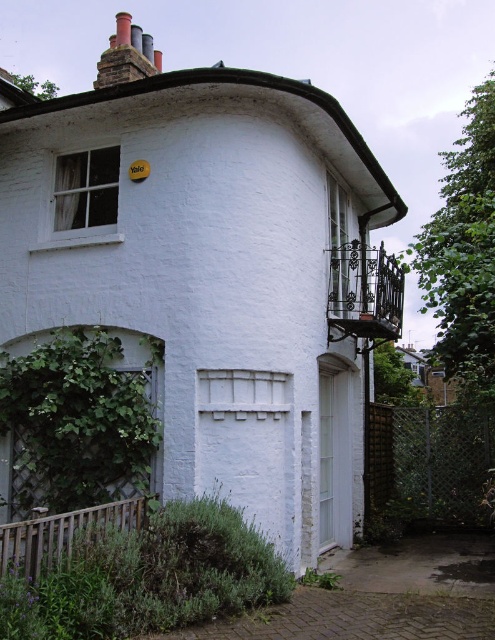
Who is lower down, green leafy ivy at lower left or smooth brick chimney at upper left?

green leafy ivy at lower left is below.

This screenshot has width=495, height=640. Find the location of `green leafy ivy at lower left`. green leafy ivy at lower left is located at coordinates (76, 420).

This screenshot has width=495, height=640. In order to click on green leafy ivy at lower left in this screenshot , I will do `click(76, 420)`.

Does point (79, 444) come closer to viewer compared to point (488, 362)?

Yes, it is in front of point (488, 362).

Where is `green leafy ivy at lower left`? green leafy ivy at lower left is located at coordinates (76, 420).

Who is more distant from viewer, (48, 458) or (485, 368)?

The point (485, 368) is behind.

Find the location of a particular element. green leafy ivy at lower left is located at coordinates (76, 420).

Can you confirm if green leafy ivy at upper right is positioned to the left of smooth brick chimney at upper left?

No, green leafy ivy at upper right is not to the left of smooth brick chimney at upper left.

Is point (448, 177) more distant than point (140, 64)?

That is True.

Image resolution: width=495 pixels, height=640 pixels. Find the location of `green leafy ivy at upper right`. green leafy ivy at upper right is located at coordinates (463, 252).